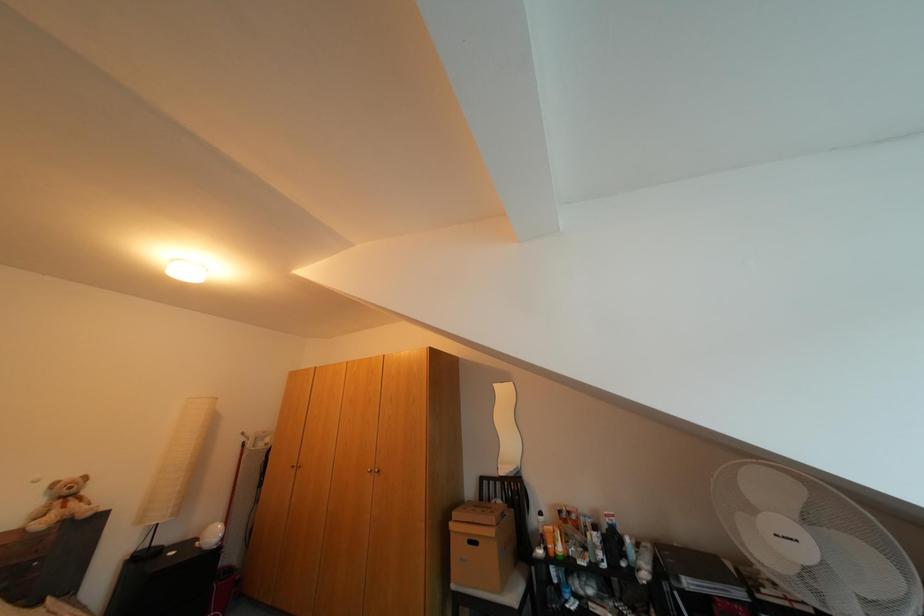
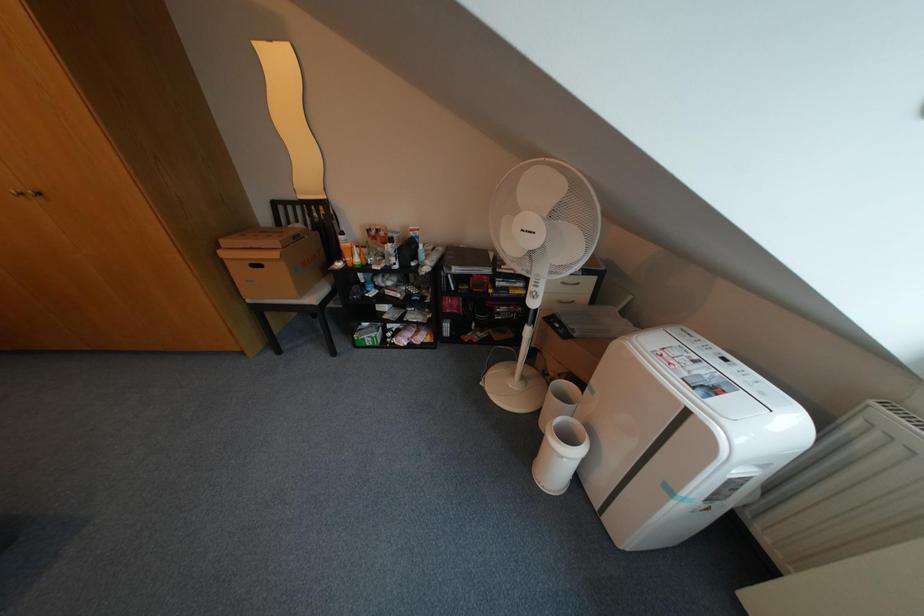
Looking at this image, the first image is from the beginning of the video and the second image is from the end. How did the camera likely rotate when shooting the video?

The camera rotated toward right-down.